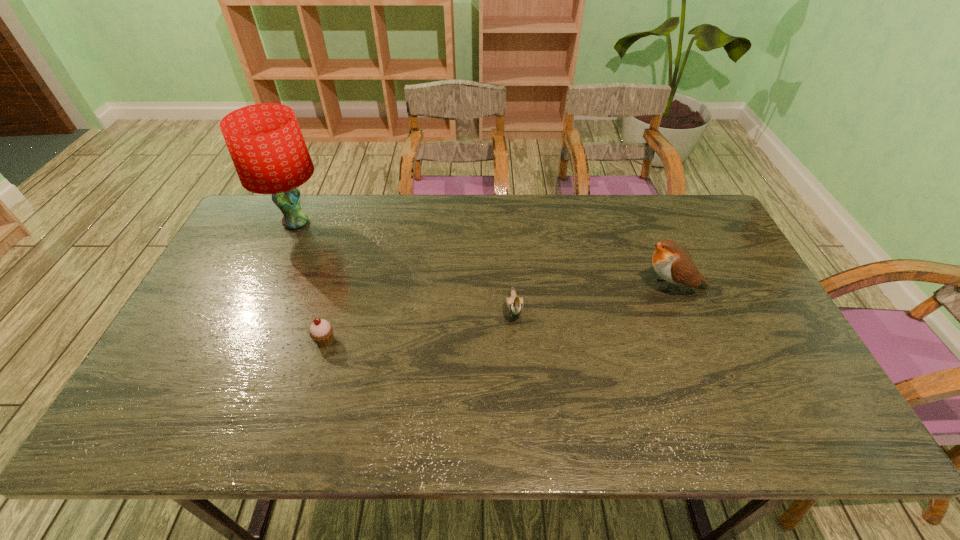
In the image, there is a desktop. Where is `free space at the left edge`? free space at the left edge is located at coordinates (198, 393).

The image size is (960, 540). In the image, there is a desktop. In order to click on vacant space at the right edge in this screenshot , I will do `click(758, 317)`.

In the image, there is a desktop. Find the location of `vacant area at the far left corner`. vacant area at the far left corner is located at coordinates (264, 238).

At what (x,y) coordinates should I click in order to perform the action: click on free space at the far right corner of the desktop. Please return your answer as a coordinate pair (x, y). Looking at the image, I should click on (714, 235).

Where is `vacant space at the near right corner of the desktop`? This screenshot has width=960, height=540. vacant space at the near right corner of the desktop is located at coordinates (825, 407).

Where is `empty space that is in between the cupcake and the third object from left to right`? empty space that is in between the cupcake and the third object from left to right is located at coordinates (420, 324).

At what (x,y) coordinates should I click in order to perform the action: click on empty location between the farthest object and the shortest object. Please return your answer as a coordinate pair (x, y). The width and height of the screenshot is (960, 540). Looking at the image, I should click on (311, 281).

Where is `vacant point located between the taller bird and the second shortest object`? The height and width of the screenshot is (540, 960). vacant point located between the taller bird and the second shortest object is located at coordinates (592, 297).

Locate an element on the screen. vacant area that lies between the lampshade and the shorter bird is located at coordinates (405, 265).

Identify the location of free area in between the third shortest object and the third object from right to left. Image resolution: width=960 pixels, height=540 pixels. [x=498, y=313].